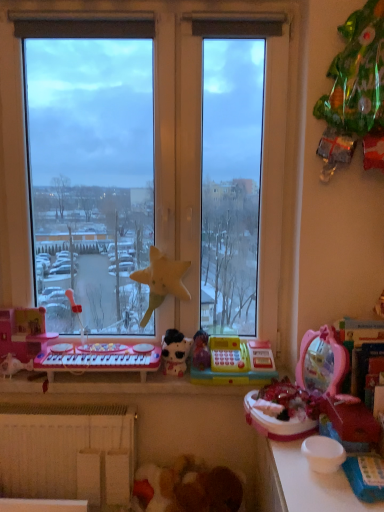
Question: From a real-world perspective, is pink plastic toy keyboard at left, which is the sixth toy in right-to-left order, positioned over yellow fabric star at center, which appears as the third toy when viewed from the left, based on gravity?

Choices:
 (A) no
 (B) yes

Answer: (A)

Question: Can we say pink plastic toy keyboard at left, acting as the second toy starting from the left, lies outside yellow fabric star at center, which is the 5th toy from right to left?

Choices:
 (A) yes
 (B) no

Answer: (A)

Question: From the image's perspective, would you say pink plastic toy keyboard at left, which is the sixth toy in right-to-left order, is shown under yellow fabric star at center, which appears as the third toy when viewed from the left?

Choices:
 (A) yes
 (B) no

Answer: (A)

Question: From a real-world perspective, is pink plastic toy keyboard at left, acting as the second toy starting from the left, below yellow fabric star at center, which appears as the third toy when viewed from the left?

Choices:
 (A) no
 (B) yes

Answer: (B)

Question: Is pink plastic toy keyboard at left, which is the sixth toy in right-to-left order, thinner than yellow fabric star at center, which appears as the third toy when viewed from the left?

Choices:
 (A) yes
 (B) no

Answer: (B)

Question: Is pink plastic musical keyboard at lower left in front of or behind white glossy plush at center, the 4th toy when ordered from right to left, in the image?

Choices:
 (A) behind
 (B) front

Answer: (B)

Question: Is pink plastic musical keyboard at lower left bigger or smaller than white glossy plush at center, the fourth toy from the left?

Choices:
 (A) big
 (B) small

Answer: (A)

Question: Visually, is pink plastic musical keyboard at lower left positioned to the left or to the right of white glossy plush at center, the fourth toy from the left?

Choices:
 (A) left
 (B) right

Answer: (A)

Question: Is point (62, 354) positioned closer to the camera than point (168, 360)?

Choices:
 (A) closer
 (B) farther

Answer: (B)

Question: Is yellow plastic cash register at center, which is the third toy in right-to-left order, taller or shorter than yellow fabric star at center, which appears as the third toy when viewed from the left?

Choices:
 (A) short
 (B) tall

Answer: (A)

Question: Is yellow plastic cash register at center, which is counted as the fifth toy, starting from the left, in front of or behind yellow fabric star at center, which is the 5th toy from right to left, in the image?

Choices:
 (A) behind
 (B) front

Answer: (B)

Question: Is yellow plastic cash register at center, which is the third toy in right-to-left order, spatially inside yellow fabric star at center, which is the 5th toy from right to left, or outside of it?

Choices:
 (A) outside
 (B) inside

Answer: (A)

Question: Is point (231, 338) closer or farther from the camera than point (155, 300)?

Choices:
 (A) farther
 (B) closer

Answer: (A)

Question: From the image's perspective, is pink plastic toy keyboard at left, acting as the second toy starting from the left, above or below yellow fabric star at center, which is the 5th toy from right to left?

Choices:
 (A) above
 (B) below

Answer: (B)

Question: Visually, is pink plastic toy keyboard at left, acting as the second toy starting from the left, positioned to the left or to the right of yellow fabric star at center, which appears as the third toy when viewed from the left?

Choices:
 (A) left
 (B) right

Answer: (A)